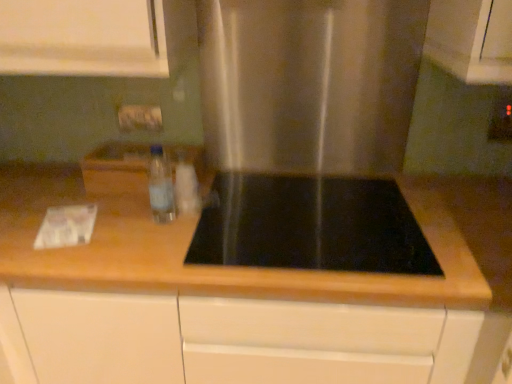
Find the location of `vacant space to the right of clear plastic bottle at center, placed as the first bottle when sorted from left to right`. vacant space to the right of clear plastic bottle at center, placed as the first bottle when sorted from left to right is located at coordinates (221, 225).